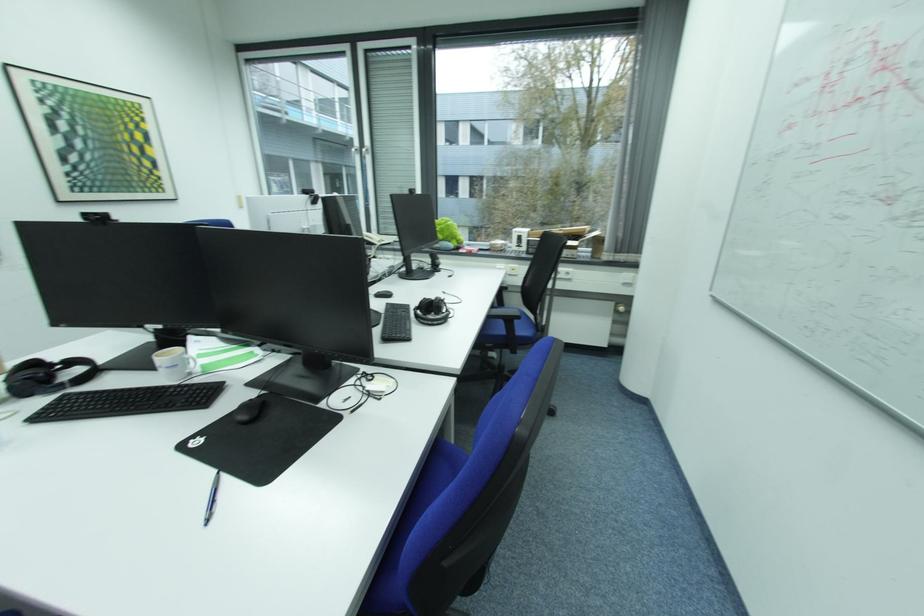
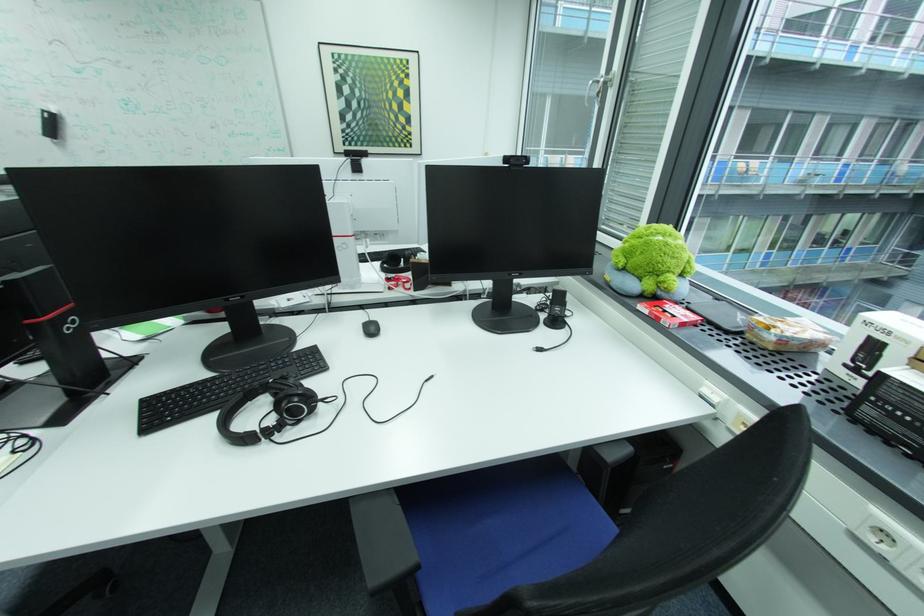
In the second image, find the point that corresponds to the point at 478,254 in the first image.

(662, 322)